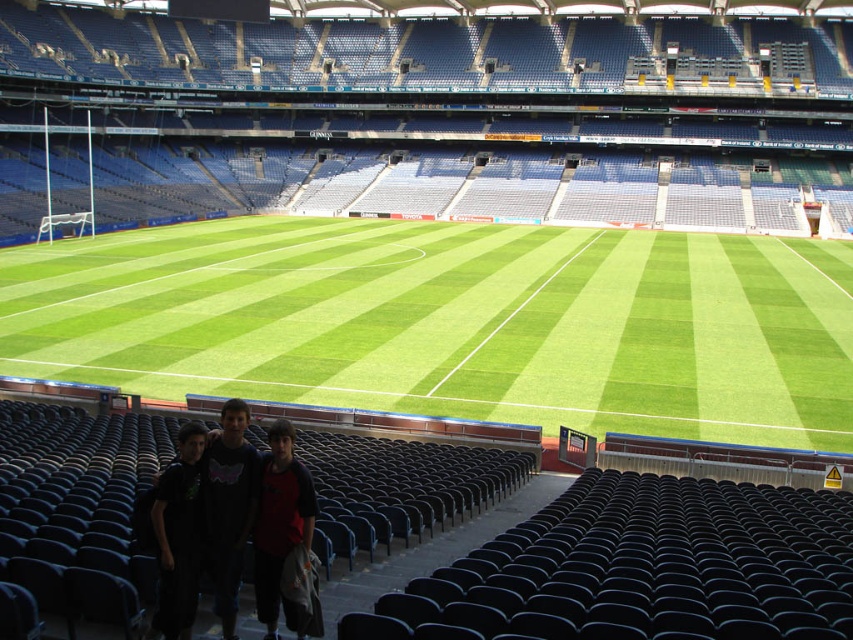
You are a photographer setting up equipment in an empty stadium. You notice two shirts at the lower center of the field. Which shirt is closer to the ground, the red fabric shirt at lower center or the black cotton shirt at lower center?

The red fabric shirt at lower center is positioned under the black cotton shirt at lower center, so the red fabric shirt at lower center is closer to the ground.

You are standing at the entrance of the stadium and want to place a small decorative flag exactly at the center of the green artificial turf at center. According to the stadium layout, what are the coordinates where you should place the flag?

The coordinates for the center of the green artificial turf at center are point [454,323], so you should place the flag there.